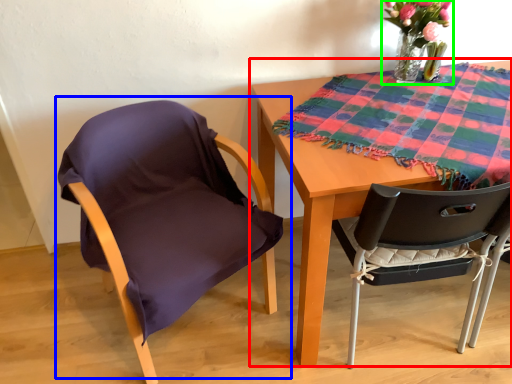
Question: Which object is positioned closest to table (highlighted by a red box)? Select from chair (highlighted by a blue box) and floral arrangement (highlighted by a green box).

Choices:
 (A) chair
 (B) floral arrangement

Answer: (A)